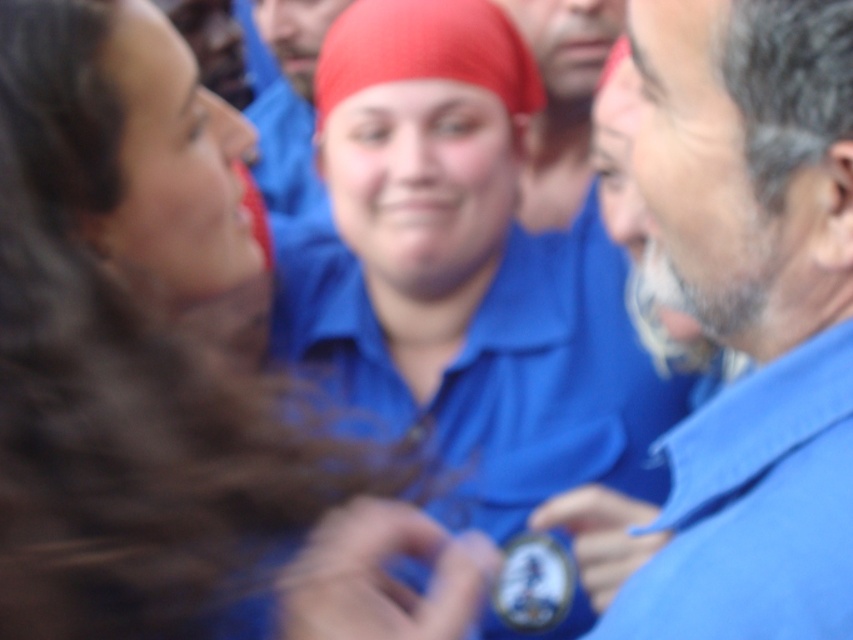
Question: Which point appears farthest from the camera in this image?

Choices:
 (A) (648, 406)
 (B) (389, 528)
 (C) (639, 570)

Answer: (A)

Question: Which is farther from the matte blue shirt at center?

Choices:
 (A) blue cotton shirt at center
 (B) blue fabric shirt at right

Answer: (A)

Question: Is matte blue shirt at center closer to the viewer compared to blue fabric shirt at right?

Choices:
 (A) no
 (B) yes

Answer: (B)

Question: Which point is farther from the camera taking this photo?

Choices:
 (A) (572, 481)
 (B) (20, 362)
 (C) (802, 440)

Answer: (A)

Question: Can you confirm if matte blue shirt at center is bigger than blue fabric shirt at right?

Choices:
 (A) no
 (B) yes

Answer: (B)

Question: In this image, where is matte blue shirt at center located relative to blue fabric shirt at right?

Choices:
 (A) left
 (B) right

Answer: (A)